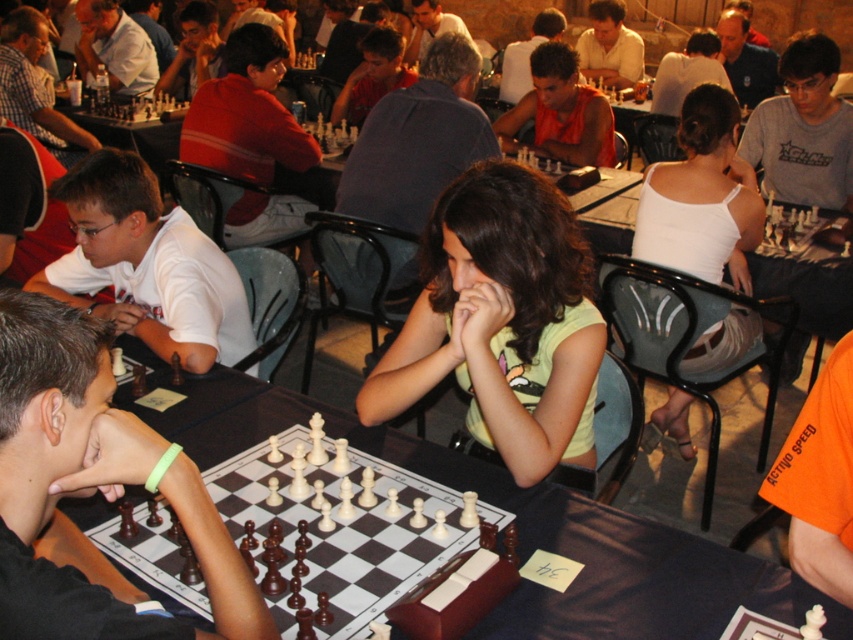
Question: Which object is farther from the camera taking this photo?

Choices:
 (A) yellow matte shirt at center
 (B) white matte shirt at left
 (C) wooden chess set at center
 (D) orange t-shirt at center

Answer: (D)

Question: Which point is farther to the camera?

Choices:
 (A) (648, 528)
 (B) (361, 467)
 (C) (538, 106)

Answer: (C)

Question: Can you confirm if wooden chessboard at center is thinner than orange t-shirt at center?

Choices:
 (A) no
 (B) yes

Answer: (A)

Question: Is white tank top at center thinner than orange t-shirt at center?

Choices:
 (A) yes
 (B) no

Answer: (A)

Question: Which object appears farthest from the camera in this image?

Choices:
 (A) wooden chessboard at center
 (B) yellow matte shirt at center

Answer: (B)

Question: Does black shirt at left appear on the left side of wooden chess set at center?

Choices:
 (A) yes
 (B) no

Answer: (A)